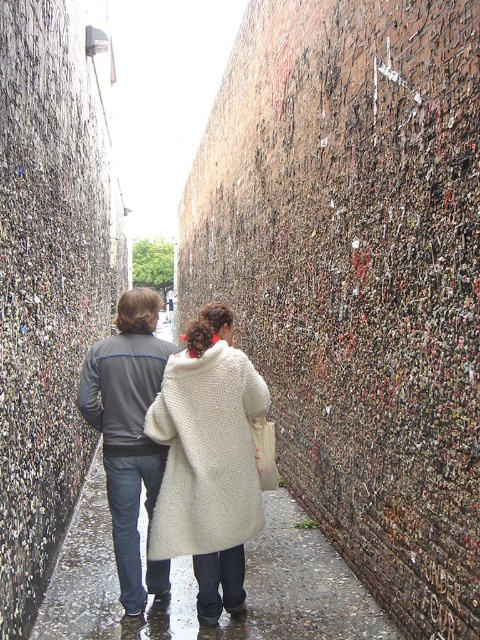
Does wet asphalt sidewalk at center have a larger size compared to gray fabric jacket at center?

No, wet asphalt sidewalk at center is not bigger than gray fabric jacket at center.

Who is higher up, wet asphalt sidewalk at center or gray fabric jacket at center?

gray fabric jacket at center is above.

Is point (113, 628) in front of point (132, 380)?

Yes, point (113, 628) is closer to viewer.

Where is `wet asphalt sidewalk at center`? wet asphalt sidewalk at center is located at coordinates (195, 586).

Does white fuzzy coat at center appear on the right side of gray fabric jacket at center?

Yes, white fuzzy coat at center is to the right of gray fabric jacket at center.

Does white fuzzy coat at center have a greater height compared to gray fabric jacket at center?

Incorrect, white fuzzy coat at center's height is not larger of gray fabric jacket at center's.

Between point (207, 314) and point (80, 394), which one is positioned in front?

Positioned in front is point (207, 314).

I want to click on white fuzzy coat at center, so click(207, 460).

Does gray fabric jacket at center appear on the right side of white fabric shopping bag at center?

No, gray fabric jacket at center is not to the right of white fabric shopping bag at center.

This screenshot has height=640, width=480. I want to click on gray fabric jacket at center, so click(127, 426).

Is point (115, 352) farther from viewer compared to point (253, 433)?

Yes, point (115, 352) is farther from viewer.

This screenshot has height=640, width=480. Identify the location of gray fabric jacket at center. (127, 426).